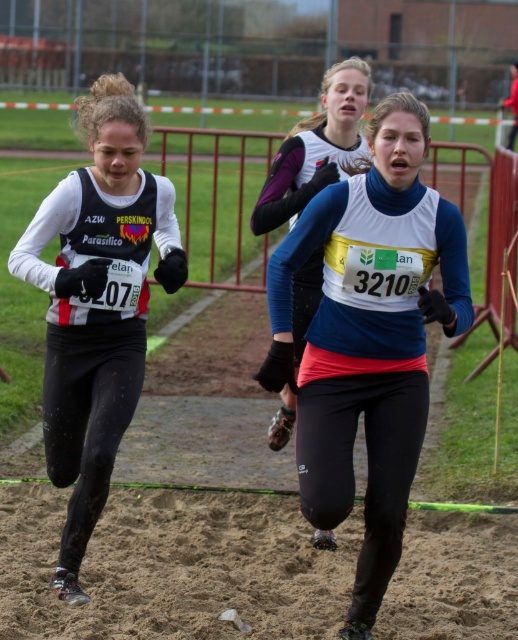
You are a photographer positioned behind the runners and want to take a photo of the blue fleece jacket at center and the matte black running suit at left. Which runner should you focus on first to ensure both are in the frame?

You should focus on the blue fleece jacket at center first because it is in front of the matte black running suit at left, so capturing it first will ensure both are visible in the frame.

From the picture: You are a photographer positioned behind the runners and want to capture a photo that includes both the blue fleece jacket at center and the matte black running suit at left. Which runner should you focus on to ensure both are visible in the frame?

You should focus on the runner wearing the blue fleece jacket at center because it has a smaller size compared to the matte black running suit at left, making it easier to fit both into the frame.

You are a photographer positioned at the camera location. You want to capture a closeup shot of the blue fleece jacket at center. Given that your camera has a minimum focusing distance of 3 meters, can you achieve this without moving closer?

The blue fleece jacket at center is 4.48 meters away from the camera. Since the minimum focusing distance is 3 meters, the camera can focus on the blue fleece jacket at center as it is beyond the minimum required distance.